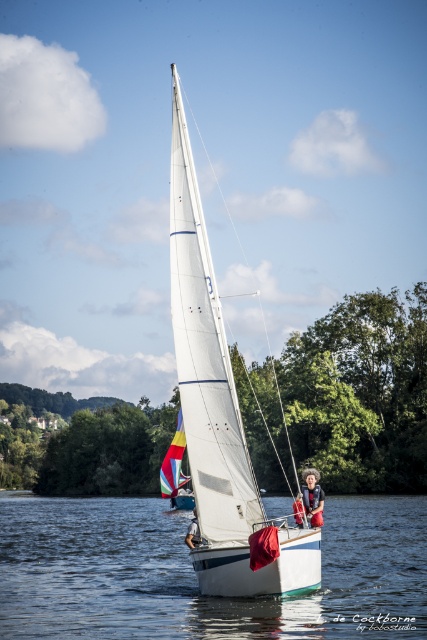
You are a photographer positioned on the shore, aiming to capture the sailboat scene. You notice the white glossy water at center and the red cotton shirt at center. Which object is nearer to your camera lens?

The white glossy water at center is closer to the viewer than the red cotton shirt at center, so the white glossy water at center would be nearer to your camera lens.

You are a photographer taking a picture of the smooth skin person at center and the red cotton shirt at center. Which one will be more visible in the photo?

The smooth skin person at center is in front of the red cotton shirt at center, so the smooth skin person at center will be more visible in the photo.